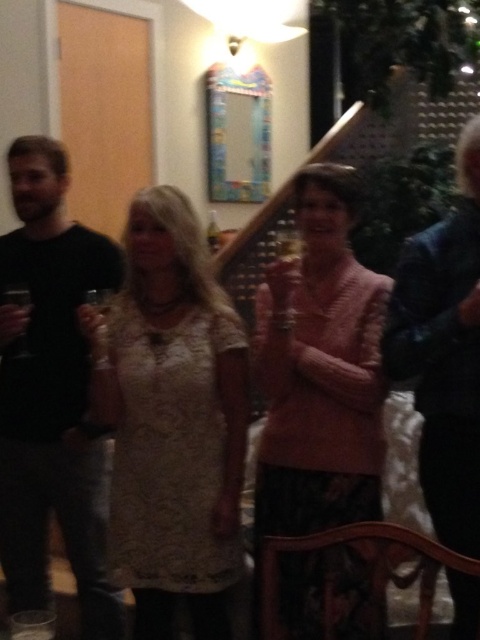
Is dark blue jacket at upper right smaller than clear glass wine glass at left?

No.

In the scene shown: Which is more to the right, dark blue jacket at upper right or clear glass wine glass at left?

dark blue jacket at upper right

Does point (399, 360) lie in front of point (4, 294)?

Yes, point (399, 360) is in front of point (4, 294).

At what (x,y) coordinates should I click in order to perform the action: click on dark blue jacket at upper right. Please return your answer as a coordinate pair (x, y). The image size is (480, 640). Looking at the image, I should click on (444, 353).

Is white lace dress at center above black matte shirt at left?

Incorrect, white lace dress at center is not positioned above black matte shirt at left.

Does white lace dress at center have a larger size compared to black matte shirt at left?

Indeed, white lace dress at center has a larger size compared to black matte shirt at left.

Who is more forward, (191, 390) or (27, 316)?

Point (191, 390) is in front.

Where is `white lace dress at center`? white lace dress at center is located at coordinates (172, 420).

In the scene shown: Who is lower down, pink knitted sweater at center or clear plastic cup at lower left?

clear plastic cup at lower left

Can you confirm if pink knitted sweater at center is positioned below clear plastic cup at lower left?

No.

What are the coordinates of `pink knitted sweater at center` in the screenshot? It's located at (320, 371).